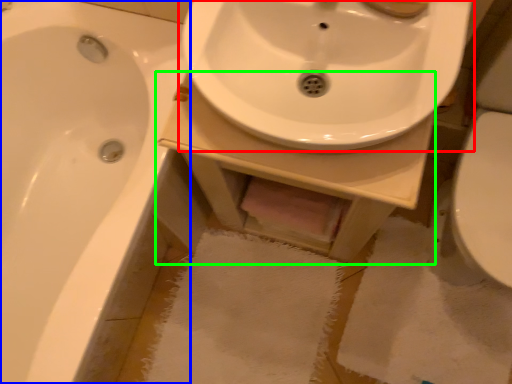
Question: Considering the real-world distances, which object is farthest from sink (highlighted by a red box)? bathtub (highlighted by a blue box) or counter top (highlighted by a green box)?

Choices:
 (A) bathtub
 (B) counter top

Answer: (A)